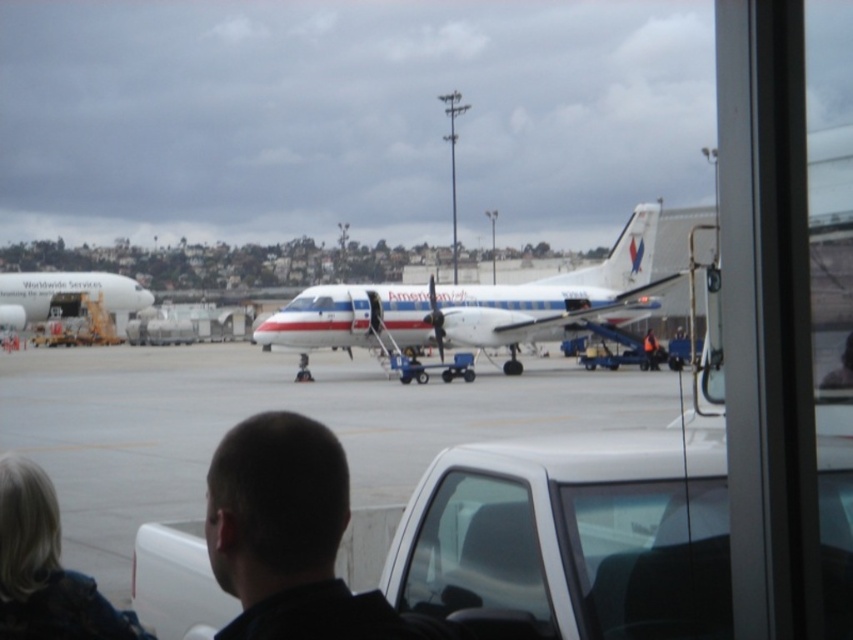
You are inside a vehicle and want to see the entire white glossy airplane at left through the transparent glass window at center. Is the window tall enough to see the top of the airplane?

The transparent glass window at center has a lesser height compared to white glossy airplane at left, so the window is not tall enough to see the top of the airplane.

In the scene shown: You are driving a forklift that is 2 meters wide. You need to transport equipment from the gray concrete tarmac at center to the transparent glass window at center. Is there enough space between them for the forklift to pass through?

The gray concrete tarmac at center is 9.58 meters away from the transparent glass window at center. Since the forklift is only 2 meters wide, there is sufficient space between them for the forklift to pass through safely.